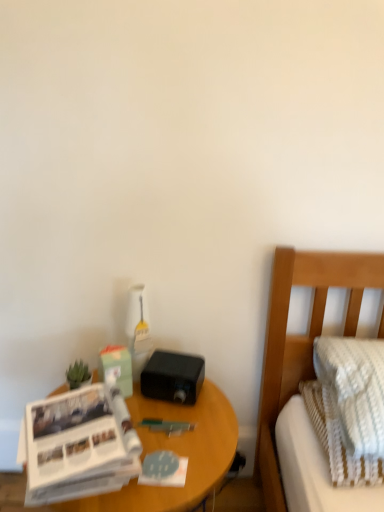
What do you see at coordinates (314, 468) in the screenshot? The width and height of the screenshot is (384, 512). I see `white textured mattress at right` at bounding box center [314, 468].

This screenshot has height=512, width=384. Describe the element at coordinates (354, 389) in the screenshot. I see `textured beige pillow at right` at that location.

Describe the element at coordinates (177, 453) in the screenshot. I see `wooden nightstand at lower left` at that location.

Find the location of `green matte plant at left`. green matte plant at left is located at coordinates (78, 375).

From the picture: Is wooden nightstand at lower left at the left side of textured beige pillow at right?

Yes.

Looking at the image, does wooden nightstand at lower left seem bigger or smaller compared to textured beige pillow at right?

In the image, wooden nightstand at lower left appears to be larger than textured beige pillow at right.

Consider the image. From a real-world perspective, between wooden nightstand at lower left and textured beige pillow at right, who is vertically lower?

Answer: wooden nightstand at lower left, from a real-world perspective.

Does wooden nightstand at lower left come behind textured beige pillow at right?

Yes, it is behind textured beige pillow at right.

Is white paper at left smaller than textured beige pillow at right?

Correct, white paper at left occupies less space than textured beige pillow at right.

In the image, is white paper at left on the left side or the right side of textured beige pillow at right?

white paper at left is to the left of textured beige pillow at right.

Could you tell me if white paper at left is facing textured beige pillow at right?

No, white paper at left does not turn towards textured beige pillow at right.

Is white paper at left far from textured beige pillow at right?

No, white paper at left is not far from textured beige pillow at right.

In the image, is white paper at left positioned in front of or behind wooden nightstand at lower left?

Clearly, white paper at left is in front of wooden nightstand at lower left.

Is white paper at left facing away from wooden nightstand at lower left?

No, white paper at left is not facing the opposite direction of wooden nightstand at lower left.

Based on their sizes in the image, would you say white paper at left is bigger or smaller than wooden nightstand at lower left?

In the image, white paper at left appears to be smaller than wooden nightstand at lower left.

From a real-world perspective, who is located lower, white paper at left or wooden nightstand at lower left?

From a 3D spatial view, wooden nightstand at lower left is below.

How far apart are white textured mattress at right and wooden nightstand at lower left?

11.63 inches.

Does point (305, 453) appear closer or farther from the camera than point (166, 507)?

Point (305, 453) appears to be farther away from the viewer than point (166, 507).

Is white textured mattress at right beside wooden nightstand at lower left?

No, white textured mattress at right is not next to wooden nightstand at lower left.

From the image's perspective, is green matte plant at left above wooden nightstand at lower left?

Yes, from the image's perspective, green matte plant at left is on top of wooden nightstand at lower left.

Which object is wider, green matte plant at left or wooden nightstand at lower left?

Wider between the two is wooden nightstand at lower left.

Does point (72, 368) come closer to viewer compared to point (129, 503)?

No, (72, 368) is behind (129, 503).

From the image's perspective, is textured beige pillow at right above white paper at left?

Yes, from the image's perspective, textured beige pillow at right is on top of white paper at left.

Which of these two, textured beige pillow at right or white paper at left, is wider?

Wider between the two is textured beige pillow at right.

Which object is further away from the camera, textured beige pillow at right or white paper at left?

textured beige pillow at right.

Consider the image. Is textured beige pillow at right inside or outside of white paper at left?

textured beige pillow at right exists outside the volume of white paper at left.

Is point (78, 382) positioned before point (87, 422)?

No, it is not.

Which is more to the right, green matte plant at left or white paper at left?

Positioned to the right is white paper at left.

From a real-world perspective, is green matte plant at left above or below white paper at left?

green matte plant at left is above white paper at left.

In order to click on nightstand directly beneath the textured beige pillow at right (from a real-world perspective) in this screenshot , I will do `click(177, 453)`.

At what (x,y) coordinates should I click in order to perform the action: click on pillow on the right of white paper at left. Please return your answer as a coordinate pair (x, y). The image size is (384, 512). Looking at the image, I should click on (354, 389).

Considering their positions, is green matte plant at left positioned closer to textured beige pillow at right than wooden nightstand at lower left?

wooden nightstand at lower left lies closer to textured beige pillow at right than the other object.

In the scene shown: From the image, which object appears to be nearer to wooden nightstand at lower left, green matte plant at left or textured beige pillow at right?

green matte plant at left.

When comparing their distances from textured beige pillow at right, does white paper at left or wooden nightstand at lower left seem closer?

Based on the image, wooden nightstand at lower left appears to be nearer to textured beige pillow at right.

Based on their spatial positions, is green matte plant at left or white textured mattress at right further from textured beige pillow at right?

The object further to textured beige pillow at right is green matte plant at left.

Looking at this image, from the image, which object appears to be farther from white paper at left, wooden nightstand at lower left or green matte plant at left?

Among the two, green matte plant at left is located further to white paper at left.

Which object lies nearer to the anchor point green matte plant at left, white paper at left or textured beige pillow at right?

white paper at left.

When comparing their distances from white textured mattress at right, does green matte plant at left or white paper at left seem further?

The object further to white textured mattress at right is green matte plant at left.

Which object lies nearer to the anchor point green matte plant at left, wooden nightstand at lower left or white paper at left?

white paper at left lies closer to green matte plant at left than the other object.

Identify the location of nightstand between white paper at left and textured beige pillow at right. (177, 453).

The image size is (384, 512). Identify the location of paperback book located between green matte plant at left and textured beige pillow at right in the left-right direction. (x=79, y=445).

Identify the location of nightstand situated between green matte plant at left and white textured mattress at right from left to right. (177, 453).

The image size is (384, 512). Find the location of `nightstand between white paper at left and white textured mattress at right`. nightstand between white paper at left and white textured mattress at right is located at coordinates (177, 453).